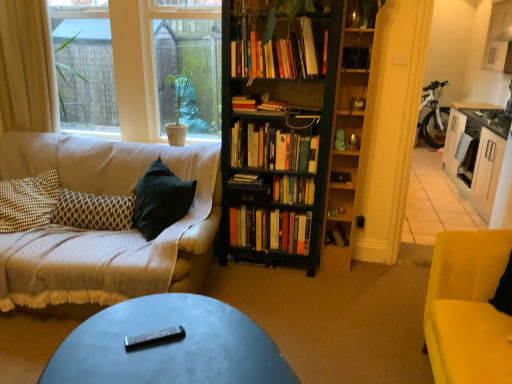
Locate an element on the screen. unoccupied space behind black plastic remote control at center is located at coordinates click(x=166, y=311).